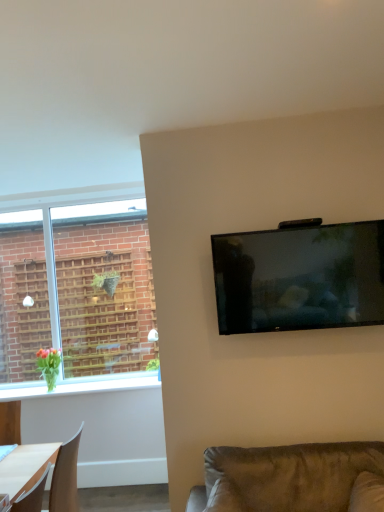
Question: Is matte black tv at upper right far from white glossy window sill at lower left?

Choices:
 (A) no
 (B) yes

Answer: (B)

Question: Is matte black tv at upper right directly adjacent to white glossy window sill at lower left?

Choices:
 (A) yes
 (B) no

Answer: (B)

Question: Considering the relative sizes of matte black tv at upper right and white glossy window sill at lower left in the image provided, is matte black tv at upper right bigger than white glossy window sill at lower left?

Choices:
 (A) yes
 (B) no

Answer: (A)

Question: Is matte black tv at upper right taller than white glossy window sill at lower left?

Choices:
 (A) no
 (B) yes

Answer: (B)

Question: Is matte black tv at upper right completely or partially outside of white glossy window sill at lower left?

Choices:
 (A) no
 (B) yes

Answer: (B)

Question: Is white glossy window sill at lower left taller or shorter than matte black tv at upper right?

Choices:
 (A) tall
 (B) short

Answer: (B)

Question: From a real-world perspective, is white glossy window sill at lower left positioned above or below matte black tv at upper right?

Choices:
 (A) above
 (B) below

Answer: (B)

Question: Considering their positions, is white glossy window sill at lower left located in front of or behind matte black tv at upper right?

Choices:
 (A) behind
 (B) front

Answer: (A)

Question: In terms of width, does white glossy window sill at lower left look wider or thinner when compared to matte black tv at upper right?

Choices:
 (A) thin
 (B) wide

Answer: (B)

Question: From the image's perspective, is matte black tv at upper right located above or below white glossy window sill at lower left?

Choices:
 (A) above
 (B) below

Answer: (A)

Question: Is matte black tv at upper right inside the boundaries of white glossy window sill at lower left, or outside?

Choices:
 (A) inside
 (B) outside

Answer: (B)

Question: Considering the relative positions of matte black tv at upper right and white glossy window sill at lower left in the image provided, is matte black tv at upper right to the left or to the right of white glossy window sill at lower left?

Choices:
 (A) left
 (B) right

Answer: (B)

Question: Does point (278, 328) appear closer or farther from the camera than point (87, 376)?

Choices:
 (A) farther
 (B) closer

Answer: (B)

Question: Is point (21, 394) closer or farther from the camera than point (306, 460)?

Choices:
 (A) closer
 (B) farther

Answer: (B)

Question: Looking at their shapes, would you say white glossy window sill at lower left is wider or thinner than suede-like brown couch at lower right?

Choices:
 (A) thin
 (B) wide

Answer: (A)